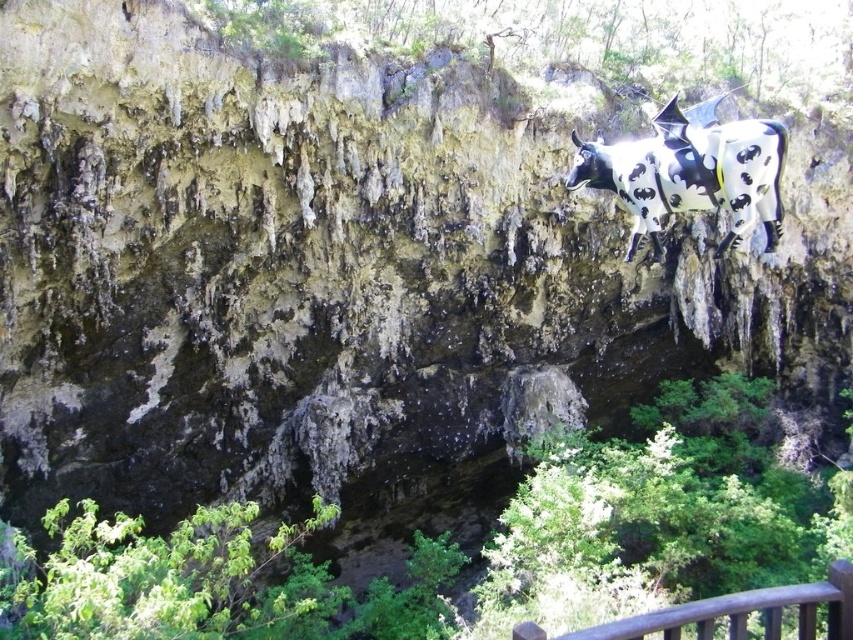
Question: Is black and white spotted cow at upper right to the right of brown wooden rail at lower right from the viewer's perspective?

Choices:
 (A) no
 (B) yes

Answer: (B)

Question: Does black and white spotted cow at upper right have a smaller size compared to brown wooden rail at lower right?

Choices:
 (A) no
 (B) yes

Answer: (B)

Question: Which object appears closest to the camera in this image?

Choices:
 (A) black and white spotted cow at upper right
 (B) brown wooden rail at lower right

Answer: (B)

Question: Which point is closer to the camera taking this photo?

Choices:
 (A) (633, 237)
 (B) (846, 604)

Answer: (B)

Question: Is black and white spotted cow at upper right closer to camera compared to brown wooden rail at lower right?

Choices:
 (A) no
 (B) yes

Answer: (A)